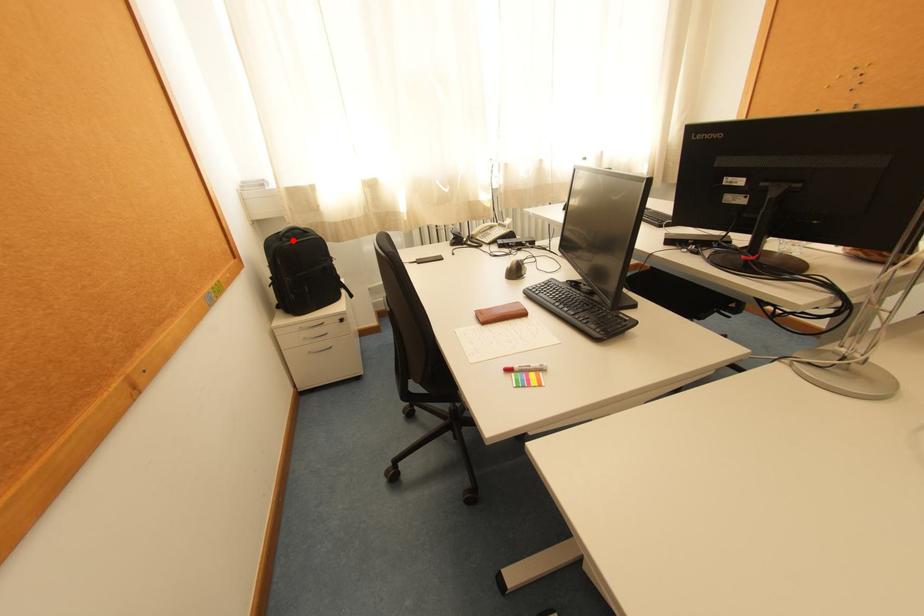
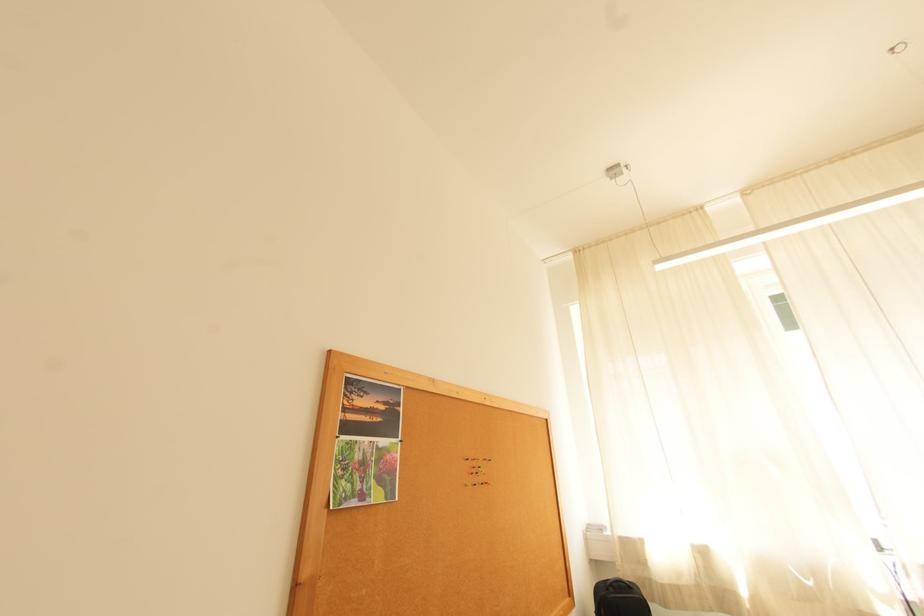
In the second image, find the point that corresponds to the highlighted location in the first image.

(619, 591)